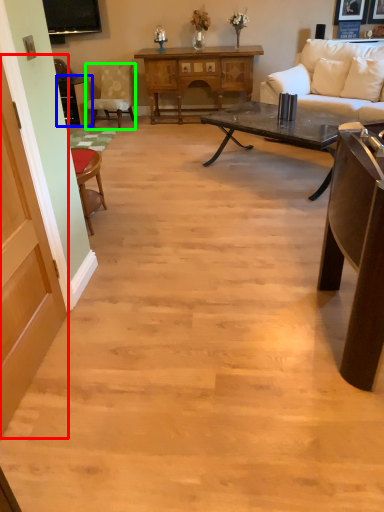
Question: Considering the real-world distances, which object is closest to glass door (highlighted by a red box)? table (highlighted by a blue box) or chair (highlighted by a green box).

Choices:
 (A) table
 (B) chair

Answer: (A)